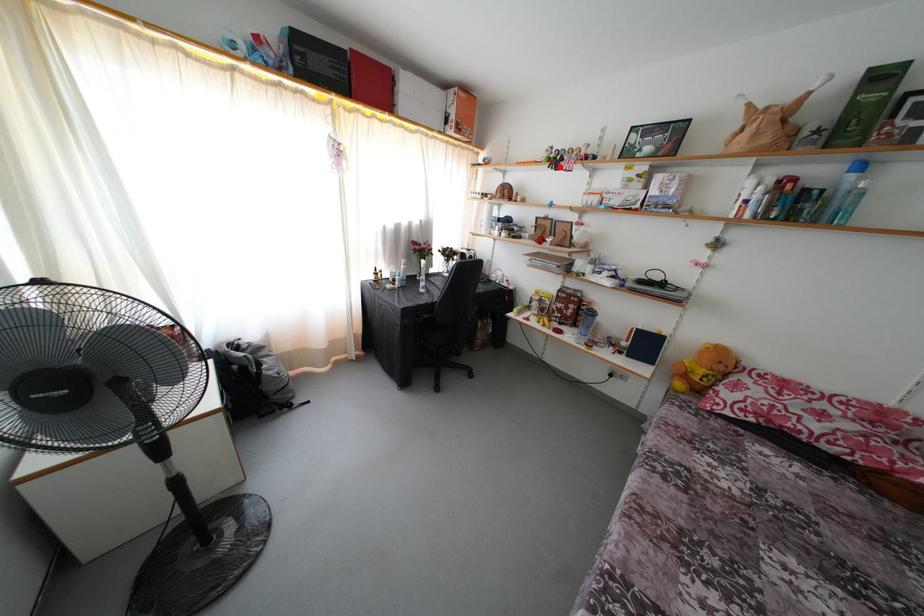
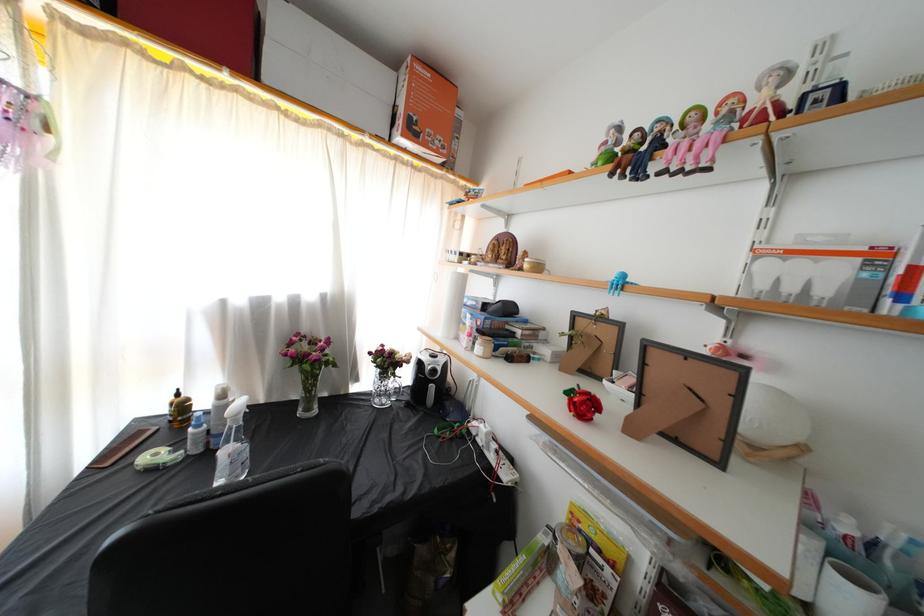
Question: A red point is marked in image1. In image2, is the corresponding 3D point closer to the camera or farther? Reply with the corresponding letter.

Choices:
 (A) The corresponding 3D point is closer.
 (B) The corresponding 3D point is farther.

Answer: (B)